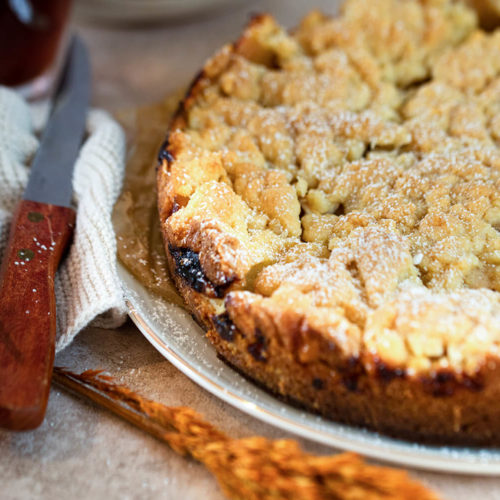
This screenshot has height=500, width=500. I want to click on handle, so click(33, 298).